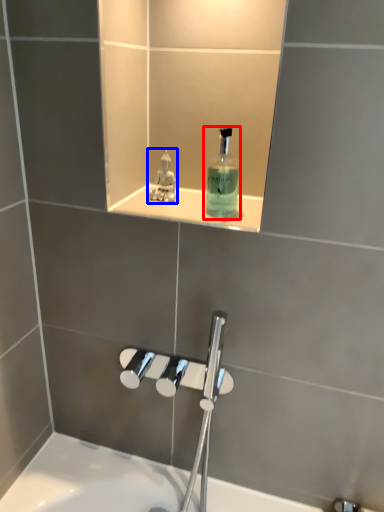
Question: Which point is closer to the camera, mouthwash (highlighted by a red box) or perfume (highlighted by a blue box)?

Choices:
 (A) mouthwash
 (B) perfume

Answer: (A)